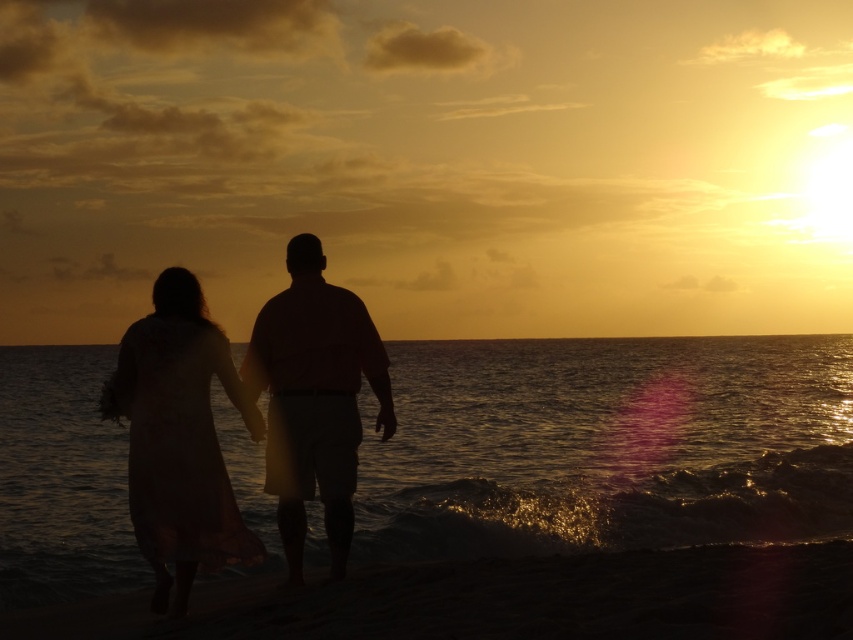
What do you see at coordinates (564, 500) in the screenshot?
I see `glistening water at lower center` at bounding box center [564, 500].

Which is behind, point (693, 416) or point (105, 413)?

Point (693, 416)

Does point (12, 492) come farther from viewer compared to point (132, 381)?

Yes.

This screenshot has height=640, width=853. I want to click on glistening water at lower center, so click(x=564, y=500).

Who is positioned more to the left, silky white dress at lower left or matte pink shirt at center?

Positioned to the left is silky white dress at lower left.

Between silky white dress at lower left and matte pink shirt at center, which one appears on the right side from the viewer's perspective?

Positioned to the right is matte pink shirt at center.

Between point (231, 548) and point (312, 340), which one is positioned in front?

Point (231, 548) is in front.

This screenshot has height=640, width=853. Identify the location of silky white dress at lower left. (x=178, y=440).

Is glistening water at lower center taller than matte pink shirt at center?

Yes, glistening water at lower center is taller than matte pink shirt at center.

Can you confirm if glistening water at lower center is wider than matte pink shirt at center?

Yes, glistening water at lower center is wider than matte pink shirt at center.

Which is behind, point (514, 589) or point (317, 438)?

The point (317, 438) is more distant.

Where is `glistening water at lower center`? This screenshot has height=640, width=853. glistening water at lower center is located at coordinates (564, 500).